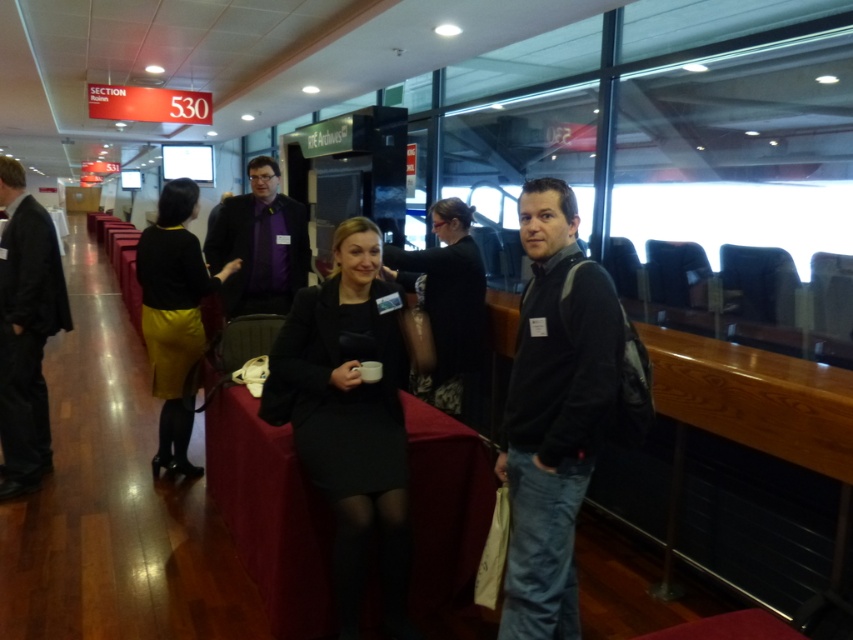
What is the exact coordinate of the smooth black table at center?

The smooth black table at center is located at coordinate point (271,515).

You are attending a formal event and want to take a photo of the person in the matte black sweater at center and the matte black suit at center. Which one will appear larger in your photo?

The matte black sweater at center will appear larger in the photo because it is closer to the viewer than the matte black suit at center.

You are attending a formal event and notice the smooth black table at center and the black dress at center. Which object is located below the other?

The smooth black table at center is positioned under the black dress at center, so the table is below the dress.